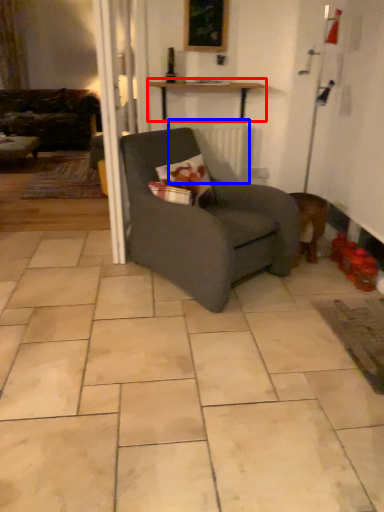
Question: Which point is further to the camera, table (highlighted by a red box) or radiator (highlighted by a blue box)?

Choices:
 (A) table
 (B) radiator

Answer: (B)